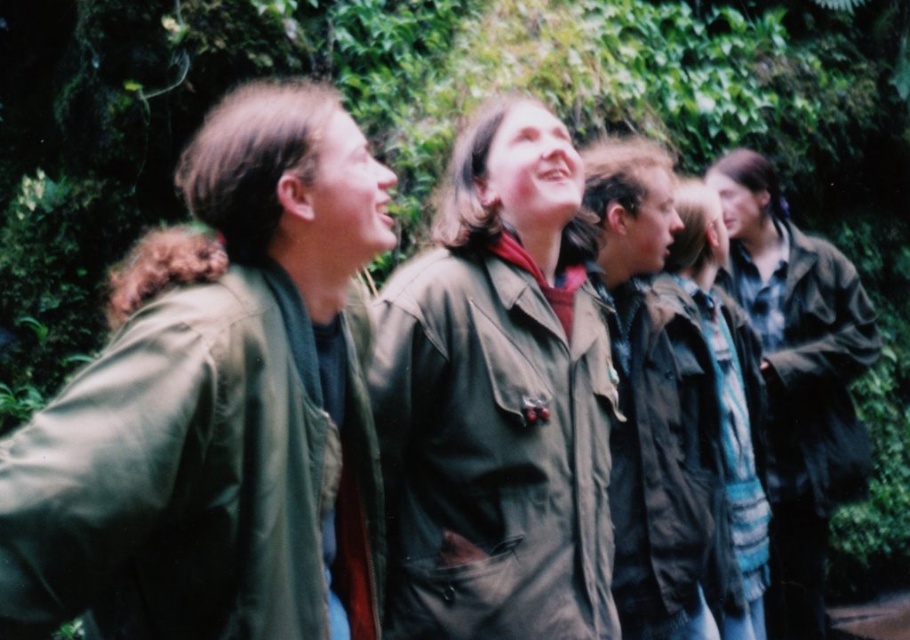
Between green canvas jacket at center and dark green textured jacket at center, which one appears on the left side from the viewer's perspective?

green canvas jacket at center is more to the left.

Is the position of green canvas jacket at center less distant than that of dark green textured jacket at center?

Yes, it is.

Where is `green canvas jacket at center`? The image size is (910, 640). green canvas jacket at center is located at coordinates (493, 449).

At what (x,y) coordinates should I click in order to perform the action: click on green canvas jacket at center. Please return your answer as a coordinate pair (x, y). This screenshot has height=640, width=910. Looking at the image, I should click on (493, 449).

Which is in front, point (107, 476) or point (703, 355)?

Point (107, 476) is more forward.

Does point (280, 160) come farther from viewer compared to point (726, 582)?

No, it is in front of (726, 582).

Is point (21, 497) closer to viewer compared to point (672, 378)?

Yes, point (21, 497) is closer to viewer.

Where is `green matte trench coat at left`? green matte trench coat at left is located at coordinates (217, 404).

Is point (678, 416) positioned before point (854, 289)?

That is True.

Where is `dark green textured jacket at center`? This screenshot has width=910, height=640. dark green textured jacket at center is located at coordinates (668, 460).